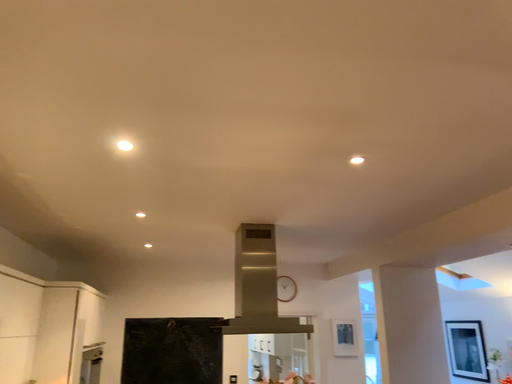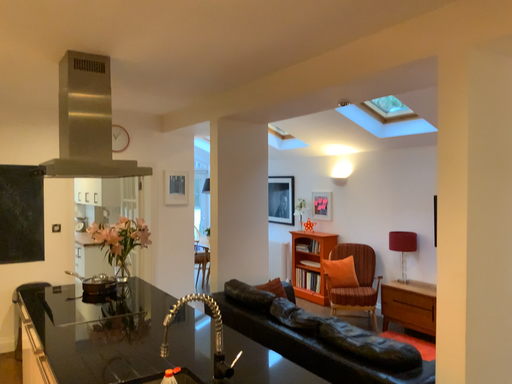
Question: Which way did the camera rotate in the video?

Choices:
 (A) rotated upward
 (B) rotated downward

Answer: (B)